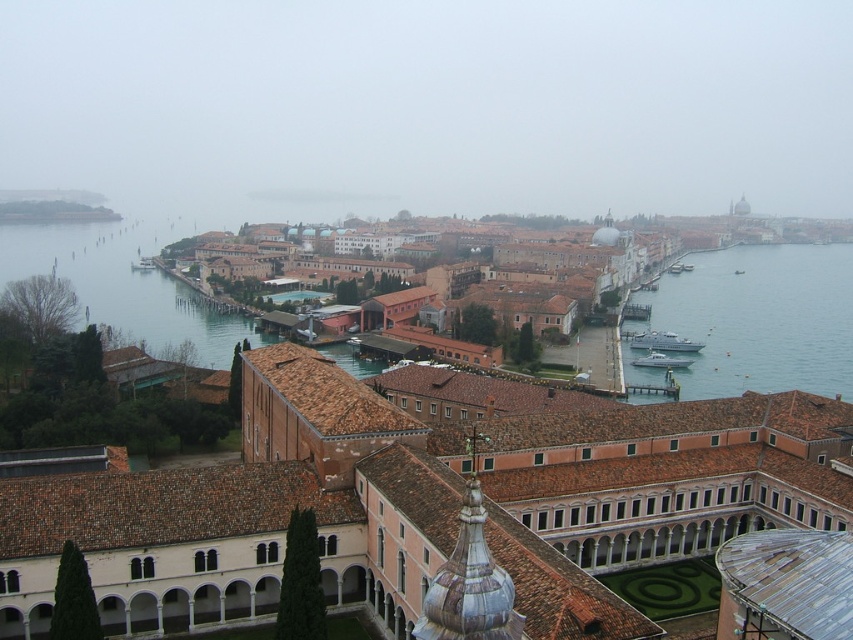
You are an architect planning to build a new structure in the historic cityscape. You need to ensure that your new building does not exceed the width of the existing structures. Given that you have a design for a building that is 15 meters wide, will it fit within the width constraints based on the brown brick buildings at center and the metallic gray boat at center?

The brown brick buildings at center are wider than the metallic gray boat at center. Since the brown brick buildings at center are the wider of the two, your new building at 15 meters must be narrower than the brown brick buildings at center. However, without knowing the exact width of the brown brick buildings at center, we cannot definitively confirm if 15 meters is acceptable. You should verify the specific width requirements of the historic cityscape.

You are a tourist in the city and want to take a photo of the brown tile roof at center and the white plastic boat at lower left. From which side of the boat should you stand to have both objects in the frame?

You should stand to the left side of the white plastic boat at lower left because the brown tile roof at center is positioned to the right of the boat, allowing both objects to be captured in the same frame.

You are a tourist standing at the waterfront in this historic city. You notice the clear blue water at lower left and the metallic gray boat at center. Which of these two has a greater width from your perspective?

The clear blue water at lower left has a greater width than the metallic gray boat at center according to the description.